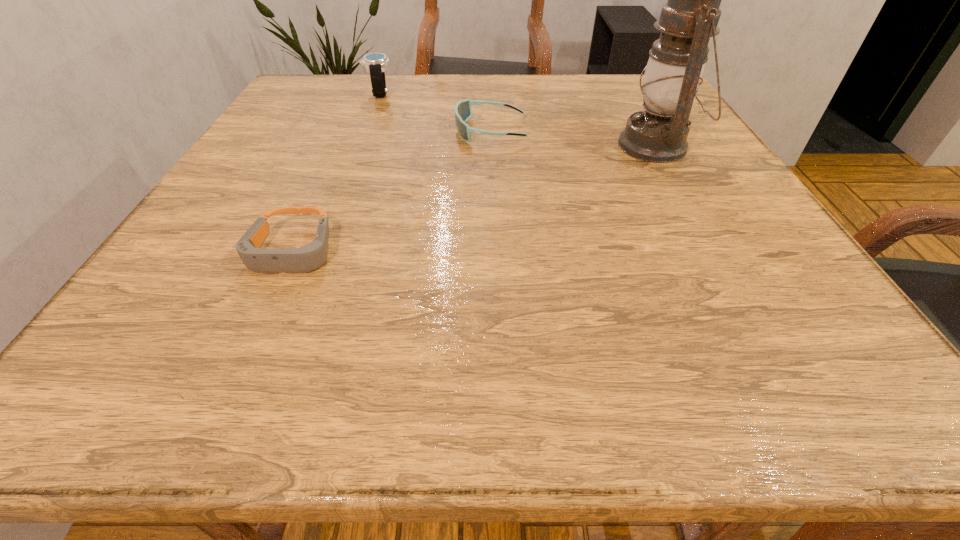
Identify the location of vacant space that satisfies the following two spatial constraints: 1. on the front-facing side of the right goggles; 2. on the right side of the rightmost object. (491, 146).

Where is `vacant position in the image that satisfies the following two spatial constraints: 1. on the back side of the rightmost object; 2. on the front-facing side of the second object from right to left`? Image resolution: width=960 pixels, height=540 pixels. vacant position in the image that satisfies the following two spatial constraints: 1. on the back side of the rightmost object; 2. on the front-facing side of the second object from right to left is located at coordinates (648, 131).